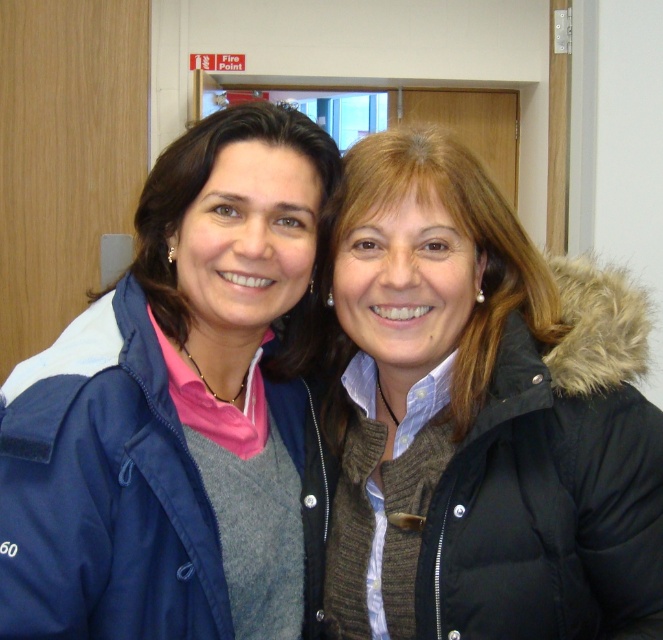
Who is lower down, black puffy jacket at right or navy blue jacket at left?

Positioned lower is black puffy jacket at right.

Does black puffy jacket at right appear under navy blue jacket at left?

Indeed, black puffy jacket at right is positioned under navy blue jacket at left.

Where is `black puffy jacket at right`? This screenshot has width=663, height=640. black puffy jacket at right is located at coordinates (552, 481).

Where is `black puffy jacket at right`? black puffy jacket at right is located at coordinates (552, 481).